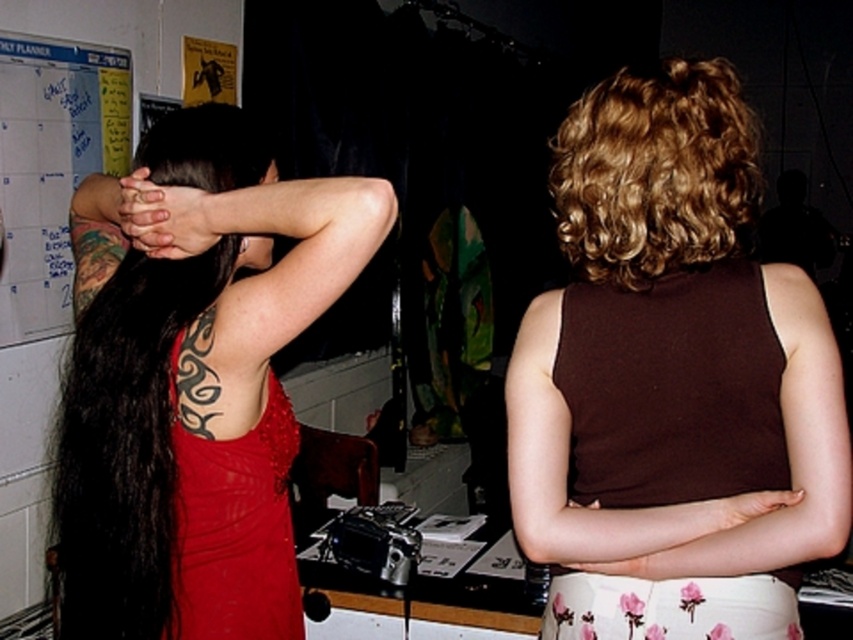
Question: Considering the real-world distances, which object is closest to the matte red dress at left?

Choices:
 (A) matte black hands at upper left
 (B) smooth skin arm at upper center

Answer: (B)

Question: Is brown matte tank top at upper right in front of smooth skin hand at right?

Choices:
 (A) yes
 (B) no

Answer: (B)

Question: Is matte red dress at left smaller than matte black hands at upper left?

Choices:
 (A) no
 (B) yes

Answer: (A)

Question: Is smooth skin arm at upper center positioned before brown matte tank top at upper right?

Choices:
 (A) no
 (B) yes

Answer: (B)

Question: Estimate the real-world distances between objects in this image. Which object is farther from the matte black hair at upper left?

Choices:
 (A) matte red dress at left
 (B) brown matte tank top at upper right

Answer: (B)

Question: Which point is farther from the camera taking this photo?

Choices:
 (A) (341, 195)
 (B) (527, 330)
 (C) (572, 513)

Answer: (B)